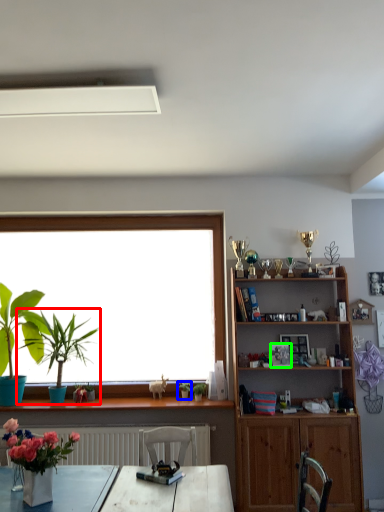
Question: Considering the real-world distances, which object is closest to houseplant (highlighted by a red box)? houseplant (highlighted by a blue box) or picture frame (highlighted by a green box).

Choices:
 (A) houseplant
 (B) picture frame

Answer: (A)